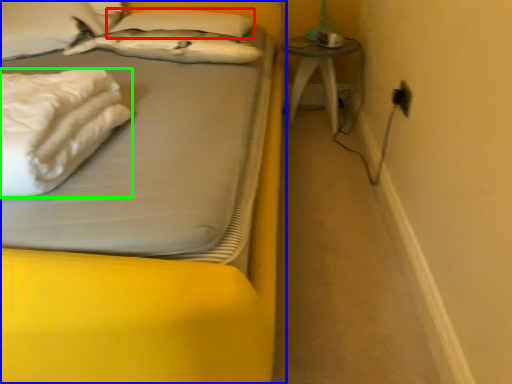
Question: Which object is the farthest from pillow (highlighted by a red box)? Choose among these: bed (highlighted by a blue box) or material (highlighted by a green box).

Choices:
 (A) bed
 (B) material

Answer: (A)